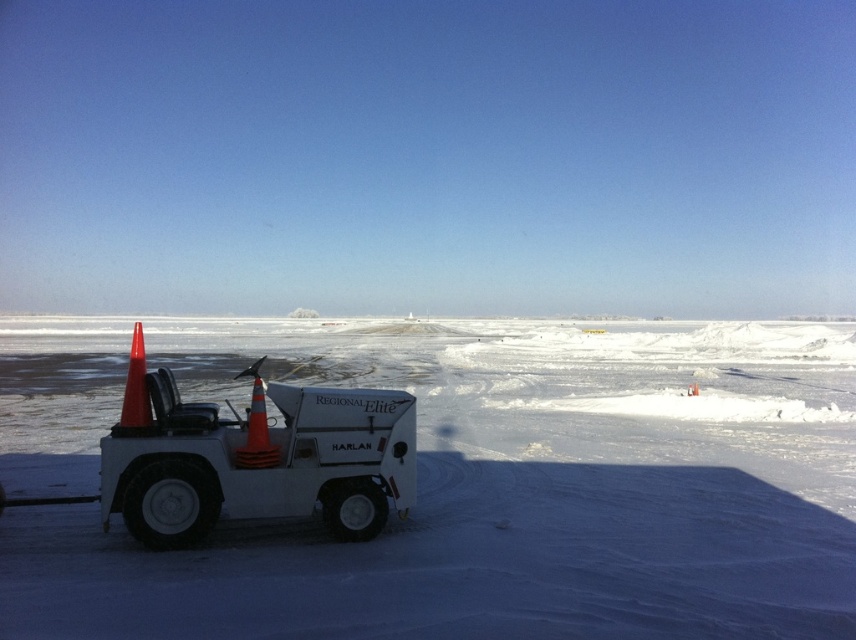
Question: Which point appears closest to the camera in this image?

Choices:
 (A) (698, 388)
 (B) (147, 404)
 (C) (824, 484)
 (D) (300, 417)

Answer: (B)

Question: Is white matte snowplow at center further to camera compared to orange matte traffic cone at left?

Choices:
 (A) no
 (B) yes

Answer: (A)

Question: Which object appears closest to the camera in this image?

Choices:
 (A) white powdery snow at lower left
 (B) orange matte traffic cone at left

Answer: (A)

Question: Can you confirm if orange matte traffic cone at left is positioned to the right of orange matte traffic cone at center?

Choices:
 (A) yes
 (B) no

Answer: (B)

Question: Among these points, which one is nearest to the camera?

Choices:
 (A) (253, 380)
 (B) (696, 392)
 (C) (298, 536)
 (D) (126, 422)

Answer: (D)

Question: Can you confirm if white matte snowplow at center is positioned to the left of orange reflective cone at left?

Choices:
 (A) yes
 (B) no

Answer: (B)